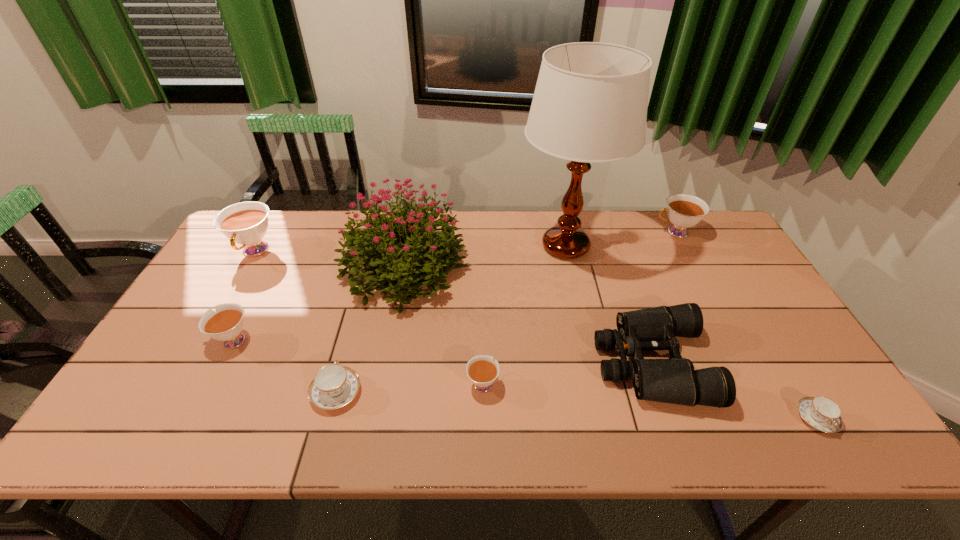
Find the location of a particular element. The width and height of the screenshot is (960, 540). the second smallest white teacup is located at coordinates (226, 324).

Locate an element on the screen. The image size is (960, 540). the fifth object from right to left is located at coordinates (482, 370).

This screenshot has width=960, height=540. I want to click on the nearest white teacup, so click(x=482, y=370).

Locate an element on the screen. The height and width of the screenshot is (540, 960). the left blue teacup is located at coordinates (334, 386).

The width and height of the screenshot is (960, 540). I want to click on the bigger blue teacup, so click(x=334, y=386).

This screenshot has height=540, width=960. I want to click on the smaller blue teacup, so click(x=823, y=414).

Identify the location of the shortest object. (823, 414).

What are the coordinates of `free space located 0.080m on the left of the table lamp` in the screenshot? It's located at (492, 246).

This screenshot has width=960, height=540. In order to click on vacant space positioned 0.390m on the left of the bouquet in this screenshot , I will do `click(215, 269)`.

Identify the location of vacant space situated 0.270m on the side of the tallest teacup with the handle. This screenshot has height=540, width=960. (204, 338).